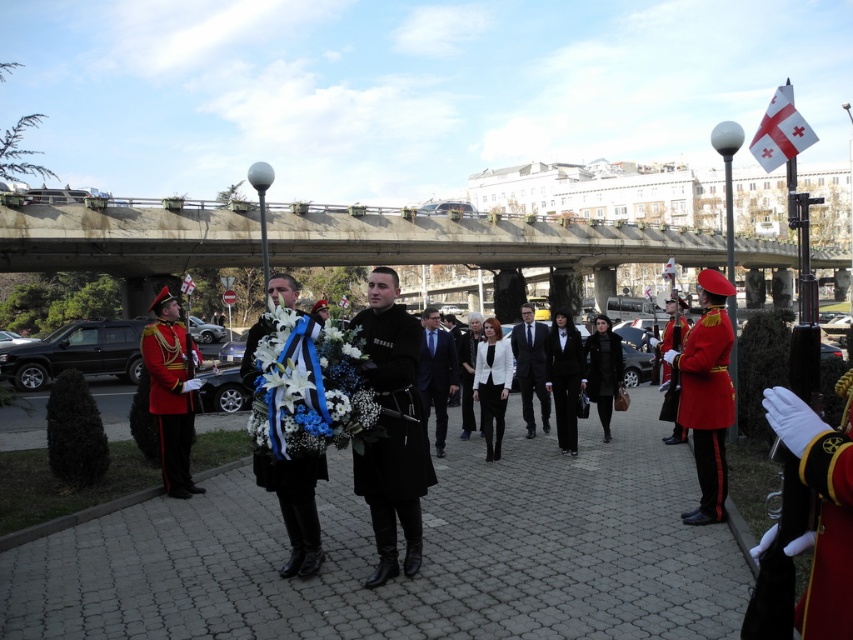
You are a photographer at the ceremony. You need to capture a photo that includes both the shiny red fabric uniform at right and the white floral wreath at center. Which object should be placed closer to the camera to ensure both fit in the frame?

The shiny red fabric uniform at right is smaller in size compared to the white floral wreath at center. To ensure both fit in the frame, the white floral wreath at center should be placed closer to the camera since it is larger and requires more space.

You are a photographer positioned at the center of the scene. You want to capture a photo that includes both the shiny red fabric uniform at right and the white floral wreath at center. What is the minimum distance you need to move to ensure both objects are in frame?

The shiny red fabric uniform at right and the white floral wreath at center are 8.97 meters apart. To include both in the photo, you need to move back until you can frame both objects, but since you are already at the center, you might need to adjust your camera angle or zoom out. However, the exact distance isn not provided in the description.

You are a photographer positioned at the center of the scene. You need to capture a photo that includes both the shiny red uniform at left and the shiny red uniform at right. Based on their positions, which uniform should you adjust your camera angle upwards to include?

The shiny red uniform at left is located above the shiny red uniform at right. To include both in the photo, you should adjust your camera angle downwards to capture the shiny red uniform at right since it is lower.